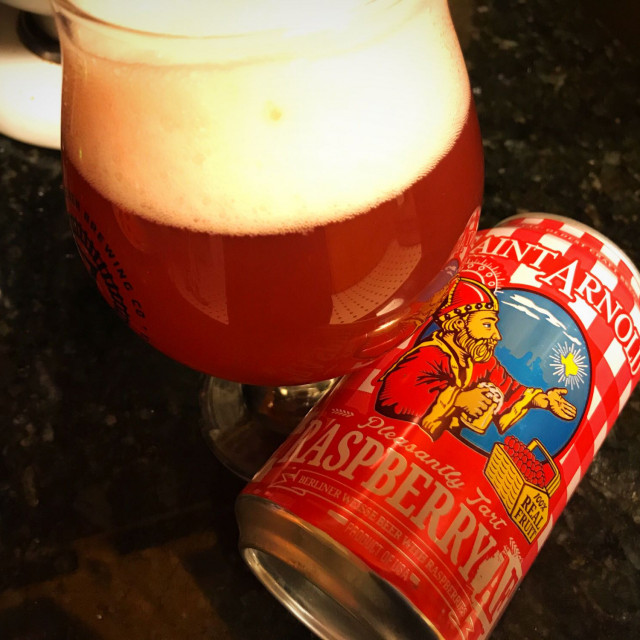
Where is `beer glass`? The width and height of the screenshot is (640, 640). beer glass is located at coordinates point(292,305).